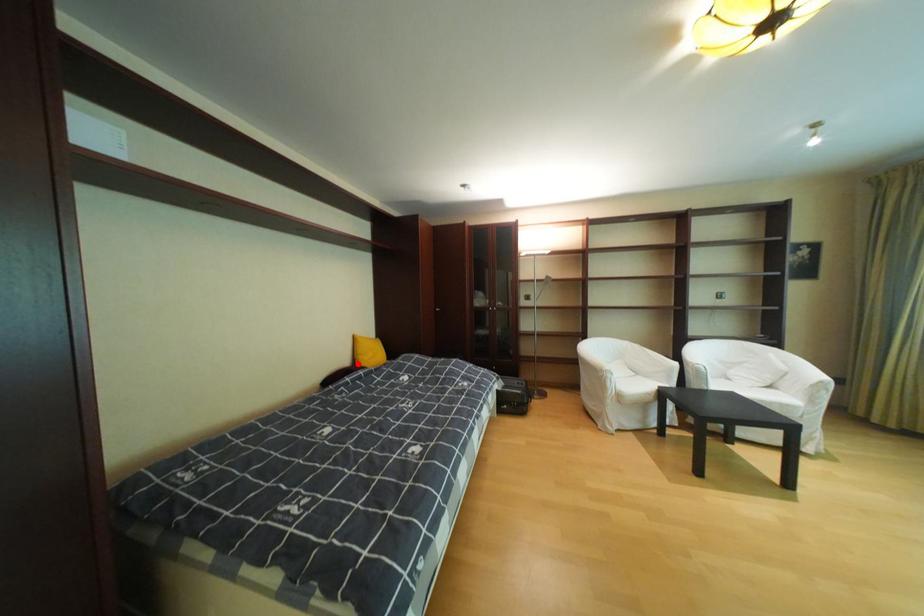
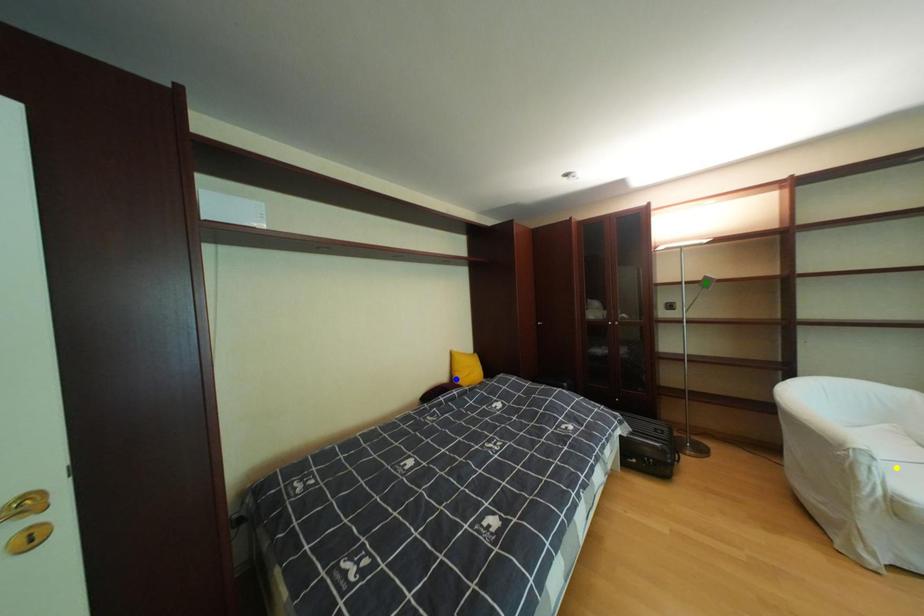
Question: I am providing you with two images of the same scene from different viewpoints. A red point is marked on the first image. You are given multiple points on the second image. Can you choose the point in image 2 that corresponds to the point in image 1?

Choices:
 (A) green point
 (B) yellow point
 (C) blue point

Answer: (C)